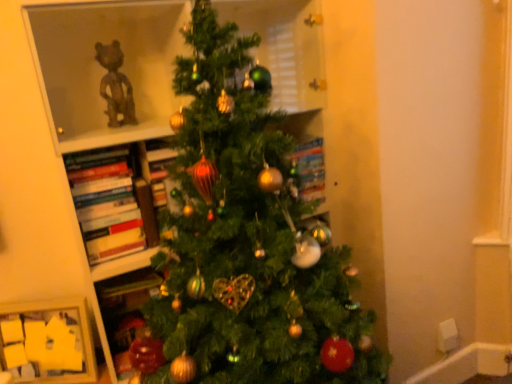
Question: Is green matte christmas tree at center with wooden picture frame at lower left?

Choices:
 (A) no
 (B) yes

Answer: (A)

Question: Is green matte christmas tree at center further to the viewer compared to wooden picture frame at lower left?

Choices:
 (A) no
 (B) yes

Answer: (A)

Question: Does green matte christmas tree at center appear on the right side of wooden picture frame at lower left?

Choices:
 (A) no
 (B) yes

Answer: (B)

Question: From the image's perspective, would you say green matte christmas tree at center is shown under wooden picture frame at lower left?

Choices:
 (A) yes
 (B) no

Answer: (B)

Question: From a real-world perspective, is green matte christmas tree at center positioned over wooden picture frame at lower left based on gravity?

Choices:
 (A) yes
 (B) no

Answer: (A)

Question: Is green matte christmas tree at center shorter than wooden picture frame at lower left?

Choices:
 (A) no
 (B) yes

Answer: (A)

Question: From a real-world perspective, is wooden picture frame at lower left over hardcover books at left?

Choices:
 (A) yes
 (B) no

Answer: (B)

Question: Is wooden picture frame at lower left further to the viewer compared to hardcover books at left?

Choices:
 (A) yes
 (B) no

Answer: (A)

Question: Is hardcover books at left at the back of wooden picture frame at lower left?

Choices:
 (A) yes
 (B) no

Answer: (B)

Question: Is wooden picture frame at lower left directly adjacent to hardcover books at left?

Choices:
 (A) yes
 (B) no

Answer: (B)

Question: Is wooden picture frame at lower left outside hardcover books at left?

Choices:
 (A) no
 (B) yes

Answer: (B)

Question: Considering the relative positions of wooden picture frame at lower left and hardcover books at left in the image provided, is wooden picture frame at lower left to the right of hardcover books at left from the viewer's perspective?

Choices:
 (A) no
 (B) yes

Answer: (A)

Question: Does green matte christmas tree at center appear on the left side of hardcover books at left?

Choices:
 (A) no
 (B) yes

Answer: (A)